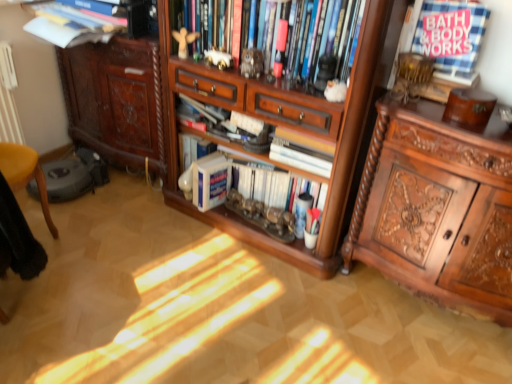
Question: Which direction should I rotate to look at white porcelain elephant at upper center, the third toy when ordered from front to back, — up or down?

Choices:
 (A) down
 (B) up

Answer: (B)

Question: Can you confirm if wooden bookshelf at upper center, positioned as the first book in top-to-bottom order, is bigger than white checkered fabric at upper right, positioned as the second book in top-to-bottom order?

Choices:
 (A) no
 (B) yes

Answer: (B)

Question: Is wooden bookshelf at upper center, which appears as the fifth book when ordered from the bottom, smaller than white checkered fabric at upper right, positioned as the second book in top-to-bottom order?

Choices:
 (A) no
 (B) yes

Answer: (A)

Question: Does wooden bookshelf at upper center, positioned as the first book in top-to-bottom order, contain white checkered fabric at upper right, placed as the fourth book when sorted from bottom to top?

Choices:
 (A) no
 (B) yes

Answer: (A)

Question: Is wooden bookshelf at upper center, which appears as the fifth book when ordered from the bottom, oriented towards white checkered fabric at upper right, placed as the fourth book when sorted from bottom to top?

Choices:
 (A) yes
 (B) no

Answer: (B)

Question: From a real-world perspective, is wooden bookshelf at upper center, which appears as the fifth book when ordered from the bottom, physically below white checkered fabric at upper right, positioned as the second book in top-to-bottom order?

Choices:
 (A) yes
 (B) no

Answer: (A)

Question: Is wooden bookshelf at upper center, which appears as the fifth book when ordered from the bottom, closer to camera compared to white checkered fabric at upper right, placed as the fourth book when sorted from bottom to top?

Choices:
 (A) yes
 (B) no

Answer: (B)

Question: Could wooden angel at upper center, positioned as the 4th toy in front-to-back order, be considered to be inside wooden cabinet at center?

Choices:
 (A) no
 (B) yes

Answer: (B)

Question: From a real-world perspective, is wooden cabinet at center physically below wooden angel at upper center, marked as the 4th toy in a right-to-left arrangement?

Choices:
 (A) no
 (B) yes

Answer: (B)

Question: From a real-world perspective, is wooden cabinet at center located higher than wooden angel at upper center, the first toy when ordered from back to front?

Choices:
 (A) no
 (B) yes

Answer: (A)

Question: From the image's perspective, is wooden cabinet at center beneath wooden angel at upper center, the first toy when ordered from back to front?

Choices:
 (A) yes
 (B) no

Answer: (A)

Question: Does wooden cabinet at center have a lesser width compared to wooden angel at upper center, positioned as the 4th toy in front-to-back order?

Choices:
 (A) no
 (B) yes

Answer: (A)

Question: Considering the relative positions of wooden cabinet at center and wooden angel at upper center, positioned as the 4th toy in front-to-back order, in the image provided, is wooden cabinet at center in front of wooden angel at upper center, positioned as the 4th toy in front-to-back order,?

Choices:
 (A) yes
 (B) no

Answer: (A)

Question: From a real-world perspective, is wooden bookshelf at upper center, positioned as the first book in top-to-bottom order, positioned over white porcelain elephant at upper center, which appears as the third toy when viewed from the right, based on gravity?

Choices:
 (A) yes
 (B) no

Answer: (A)